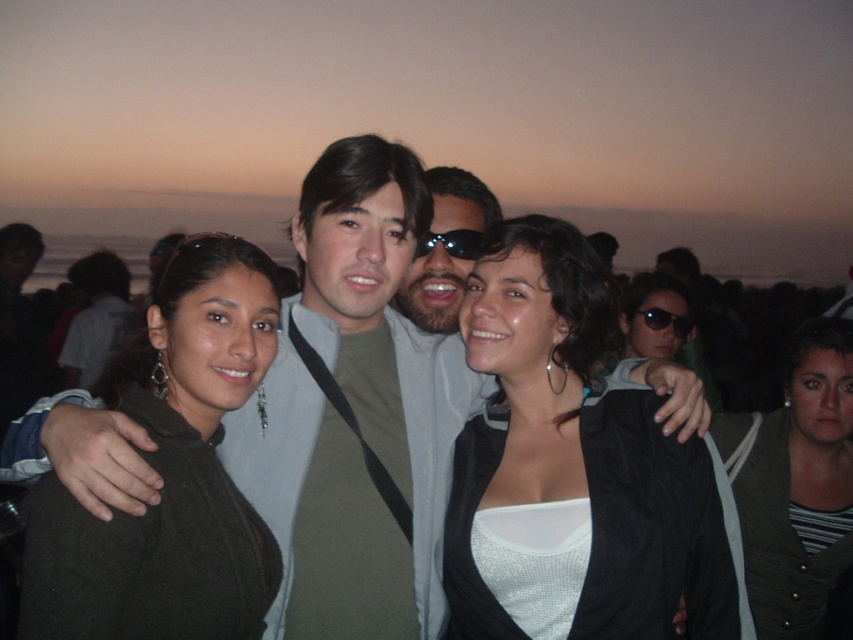
You are standing at the point marked as point [170,477] in the image. What object are you touching?

The point [170,477] is on the dark green sweater at center, so you are touching the dark green sweater at center.